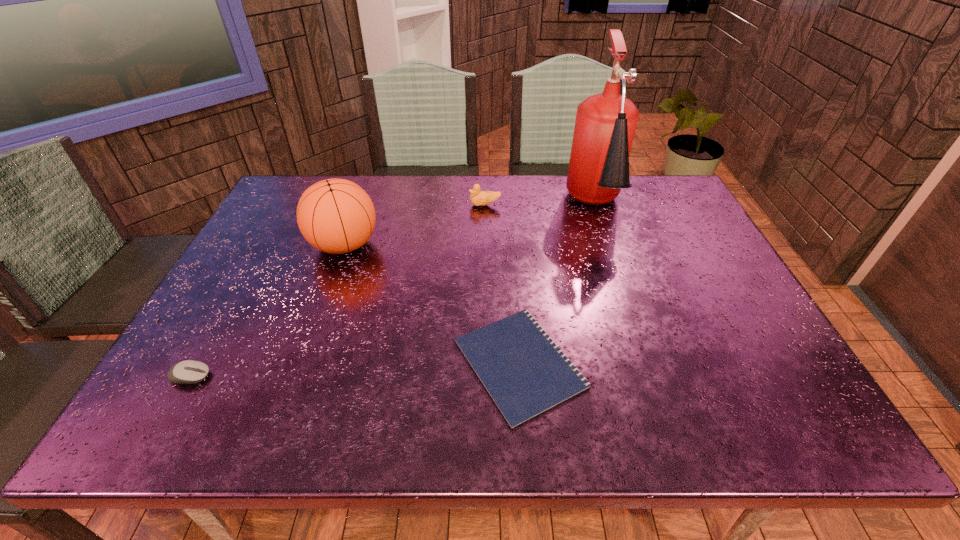
I want to click on free space that satisfies the following two spatial constraints: 1. on the face of the notepad; 2. on the right side of the duckling, so click(487, 363).